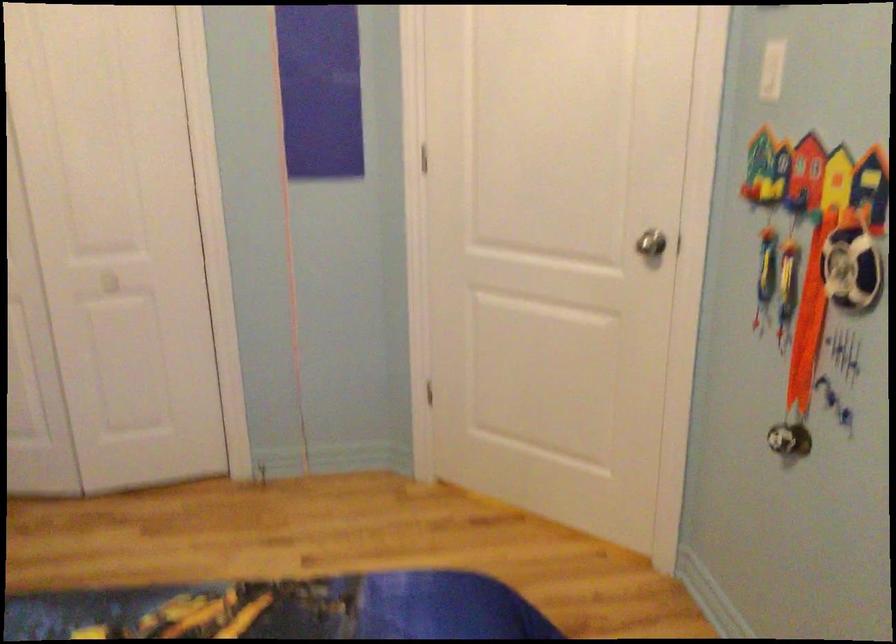
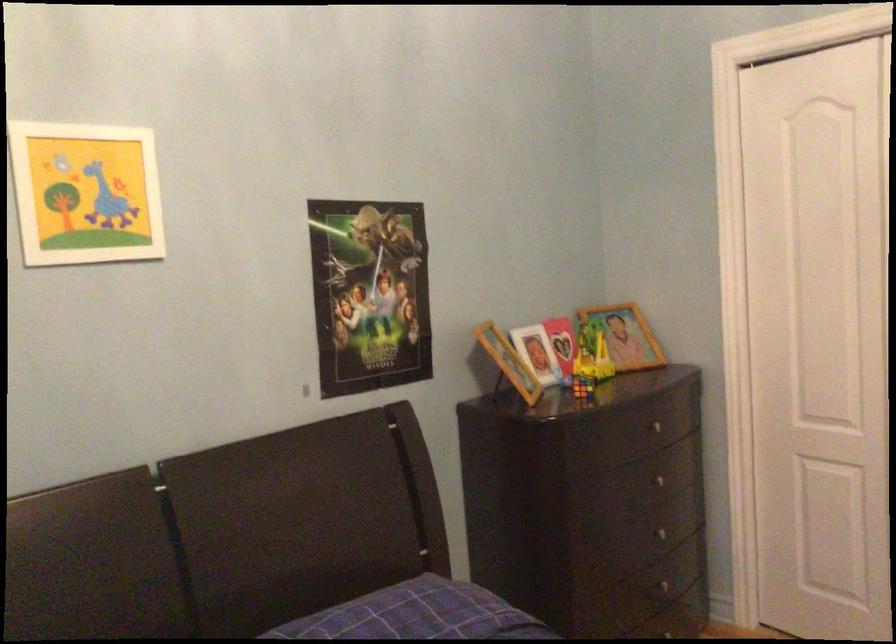
Question: The first image is from the beginning of the video and the second image is from the end. How did the camera likely rotate when shooting the video?

Choices:
 (A) Left
 (B) Right
 (C) Up
 (D) Down

Answer: (A)